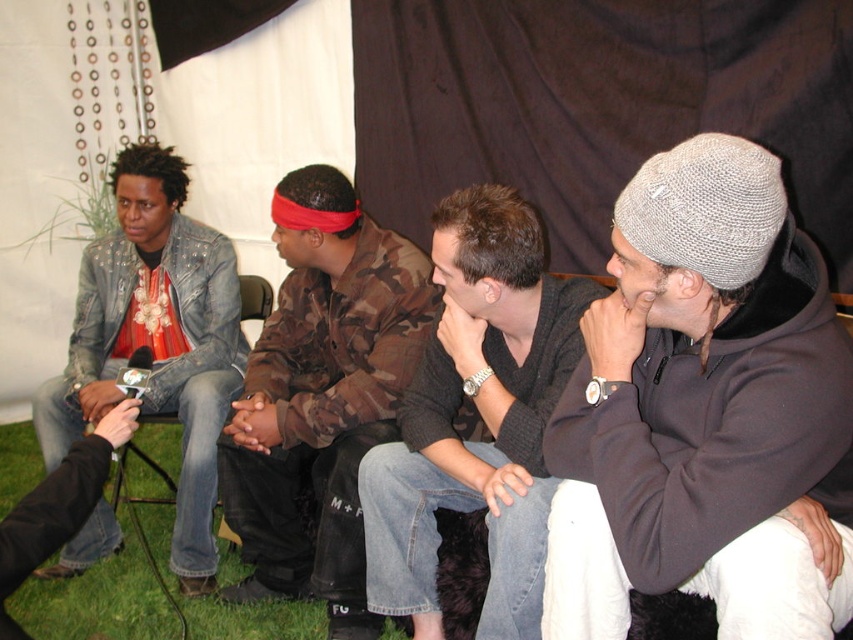
Question: Which object is farther from the camera taking this photo?

Choices:
 (A) camo-patterned jacket at center
 (B) knitted gray beanie at center

Answer: (A)

Question: Is knitted gray beanie at center above denim jacket at left?

Choices:
 (A) no
 (B) yes

Answer: (A)

Question: Can you confirm if knitted gray beanie at center is positioned above denim jacket at left?

Choices:
 (A) no
 (B) yes

Answer: (A)

Question: Can you confirm if knitted gray beanie at center is wider than dark gray knit beanie at center?

Choices:
 (A) no
 (B) yes

Answer: (A)

Question: Which point is closer to the camera taking this photo?

Choices:
 (A) (178, 444)
 (B) (160, 292)
 (C) (271, 220)

Answer: (C)

Question: Which is nearer to the knitted gray beanie at center?

Choices:
 (A) denim jacket at left
 (B) camo-patterned jacket at center
 (C) green grass at lower left

Answer: (B)